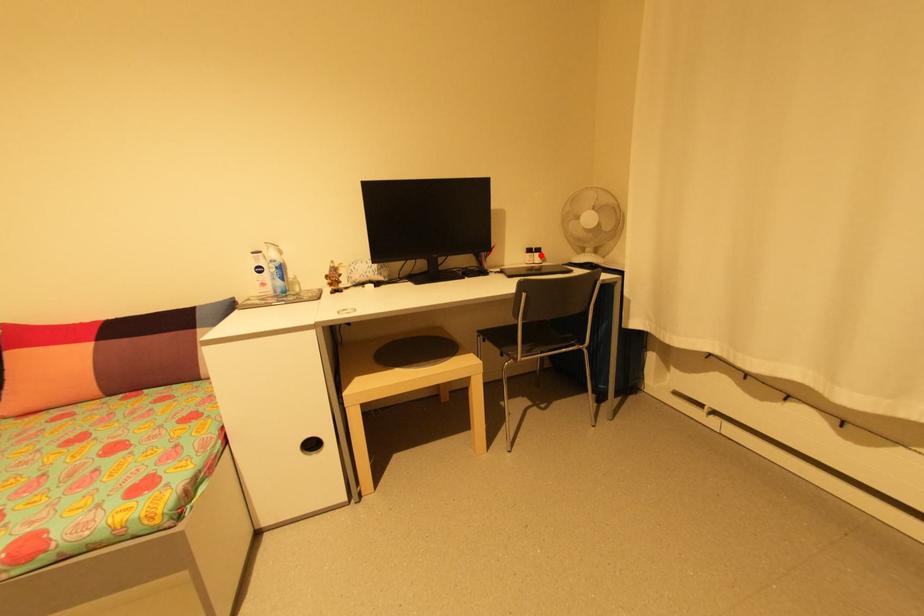
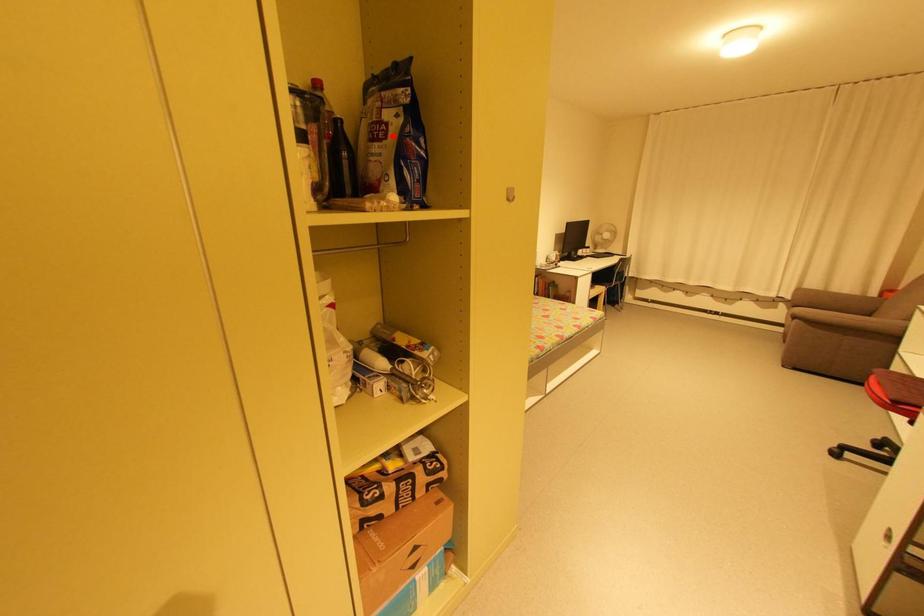
I am providing you with two images of the same scene from different viewpoints. A red point is marked on the first image and another point is marked on the second image. Are the points marked in image1 and image2 representing the same 3D position?

No